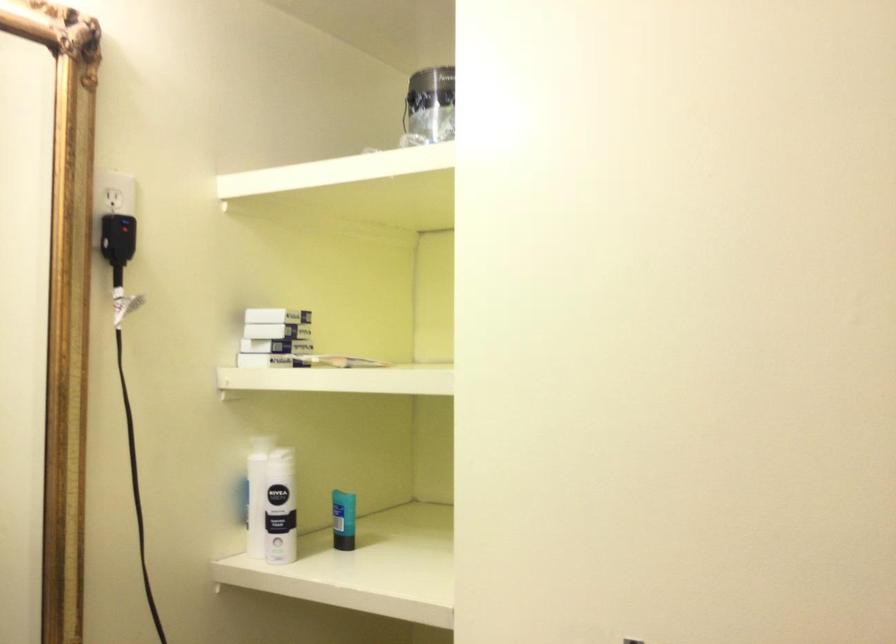
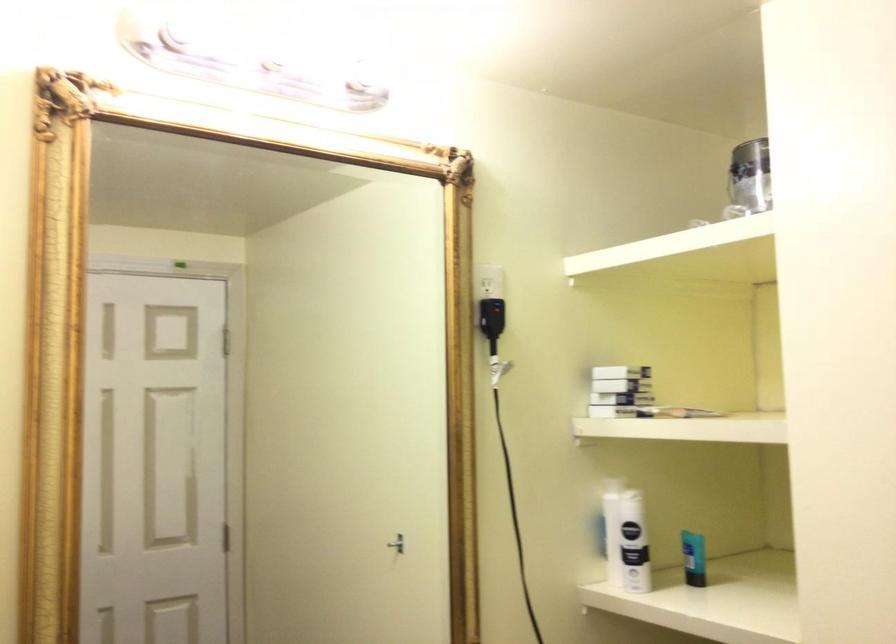
Where in the second image is the point corresponding to the point at 254,359 from the first image?

(614, 410)